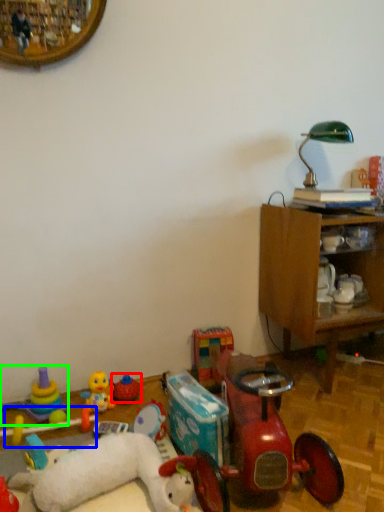
Question: Which object is positioned farthest from toy (highlighted by a red box)? Select from toy (highlighted by a blue box) and toy (highlighted by a green box).

Choices:
 (A) toy
 (B) toy

Answer: (B)